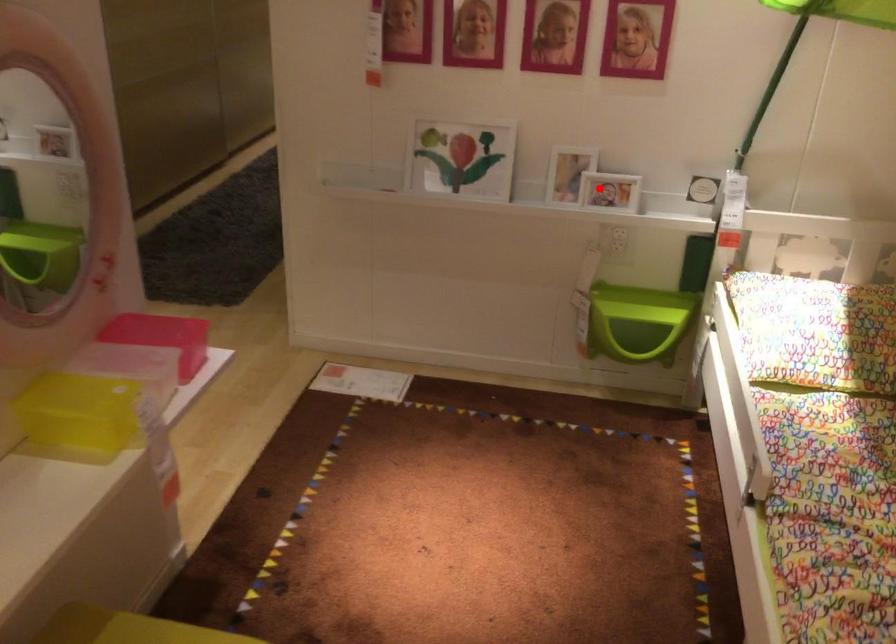
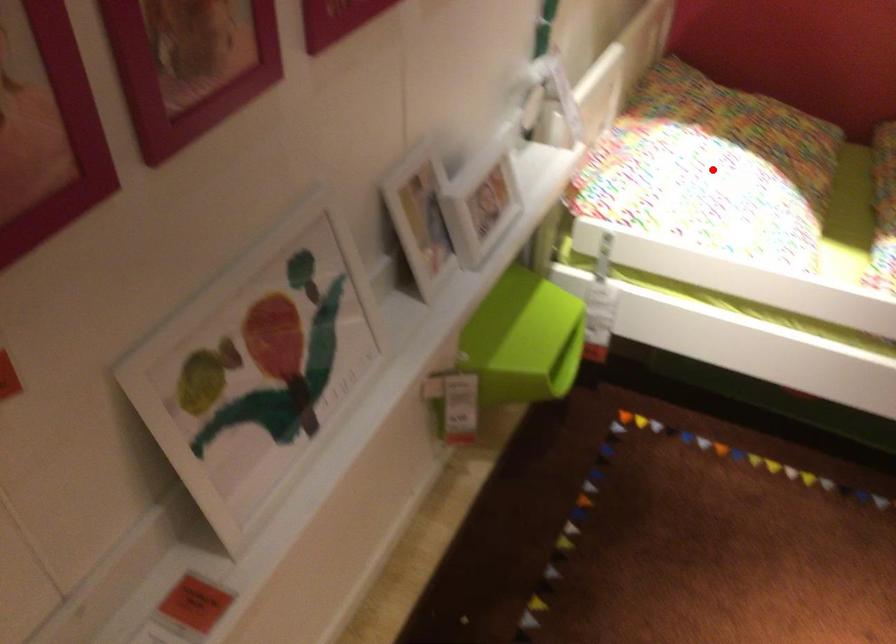
I am providing you with two images of the same scene from different viewpoints. A red point is marked on the first image and another point is marked on the second image. Does the point marked in image1 correspond to the same location as the one in image2?

No